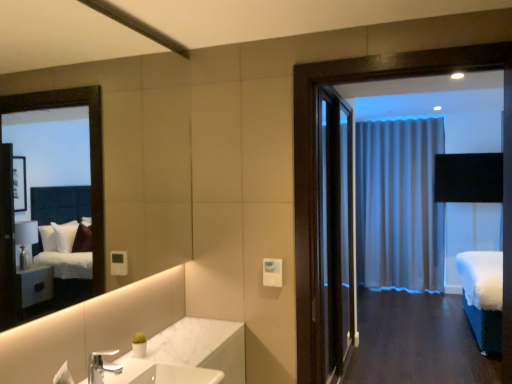
Question: From a real-world perspective, is silver metallic faucet at lower left beneath silky gray curtain at center?

Choices:
 (A) no
 (B) yes

Answer: (B)

Question: From the image's perspective, is silver metallic faucet at lower left beneath silky gray curtain at center?

Choices:
 (A) no
 (B) yes

Answer: (B)

Question: Can you confirm if silver metallic faucet at lower left is positioned to the right of silky gray curtain at center?

Choices:
 (A) no
 (B) yes

Answer: (A)

Question: Are silver metallic faucet at lower left and silky gray curtain at center making contact?

Choices:
 (A) no
 (B) yes

Answer: (A)

Question: Could silky gray curtain at center be considered to be inside silver metallic faucet at lower left?

Choices:
 (A) no
 (B) yes

Answer: (A)

Question: Would you say white fabric bed at right is inside or outside white marble sink at lower center?

Choices:
 (A) outside
 (B) inside

Answer: (A)

Question: Considering the positions of point (493, 314) and point (214, 380), is point (493, 314) closer or farther from the camera than point (214, 380)?

Choices:
 (A) closer
 (B) farther

Answer: (B)

Question: In the image, is white fabric bed at right on the left side or the right side of white marble sink at lower center?

Choices:
 (A) right
 (B) left

Answer: (A)

Question: Looking at their shapes, would you say white fabric bed at right is wider or thinner than white marble sink at lower center?

Choices:
 (A) thin
 (B) wide

Answer: (B)

Question: From a real-world perspective, relative to silver metallic faucet at lower left, is dark wood door at center vertically above or below?

Choices:
 (A) below
 (B) above

Answer: (B)

Question: Considering the positions of dark wood door at center and silver metallic faucet at lower left in the image, is dark wood door at center wider or thinner than silver metallic faucet at lower left?

Choices:
 (A) wide
 (B) thin

Answer: (A)

Question: Is point (328, 231) positioned closer to the camera than point (108, 367)?

Choices:
 (A) closer
 (B) farther

Answer: (B)

Question: Choose the correct answer: Is dark wood door at center inside silver metallic faucet at lower left or outside it?

Choices:
 (A) inside
 (B) outside

Answer: (B)

Question: In terms of height, does white fabric bed at right look taller or shorter compared to dark wood door at center?

Choices:
 (A) short
 (B) tall

Answer: (A)

Question: From the image's perspective, is white fabric bed at right located above or below dark wood door at center?

Choices:
 (A) below
 (B) above

Answer: (A)